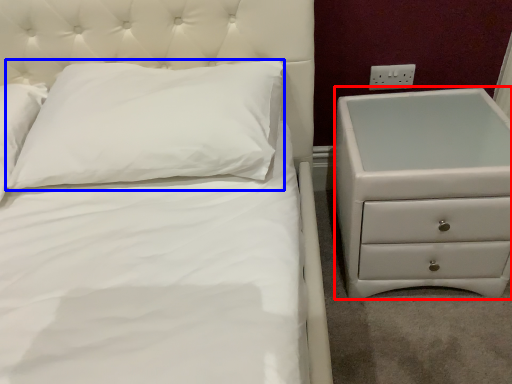
Question: Which of the following is the farthest to the observer, chest of drawers (highlighted by a red box) or pillow (highlighted by a blue box)?

Choices:
 (A) chest of drawers
 (B) pillow

Answer: (A)